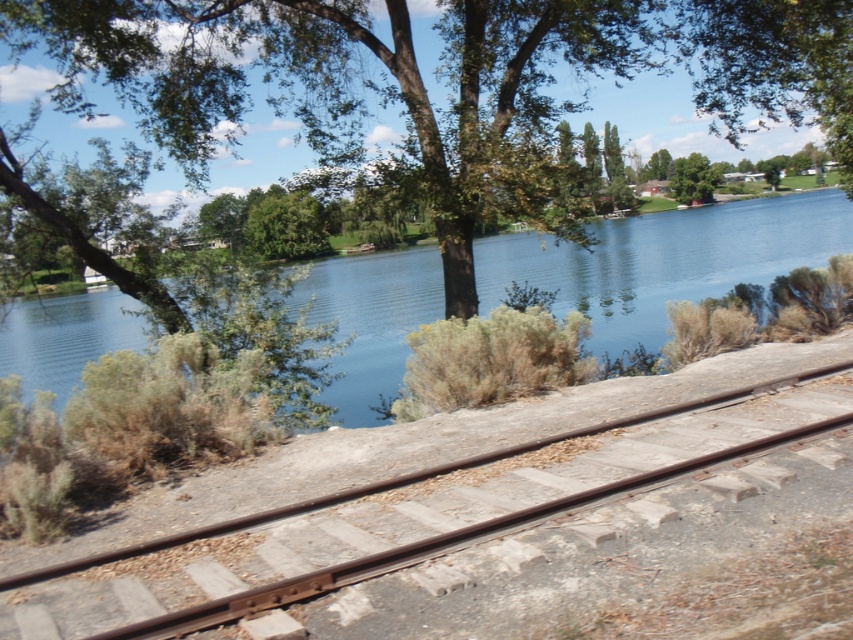
Is smooth metal train track at center smaller than blue water at center?

Correct, smooth metal train track at center occupies less space than blue water at center.

Does smooth metal train track at center have a lesser height compared to blue water at center?

Indeed, smooth metal train track at center has a lesser height compared to blue water at center.

The width and height of the screenshot is (853, 640). What are the coordinates of `smooth metal train track at center` in the screenshot? It's located at (404, 516).